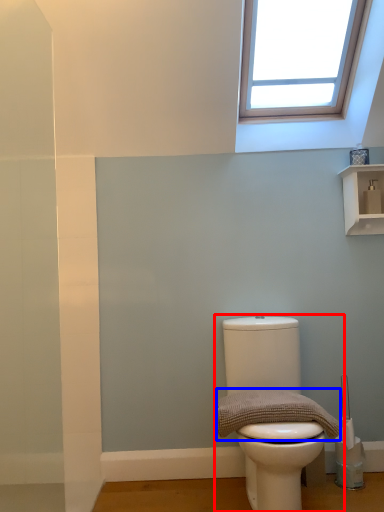
Question: Which of the following is the closest to the observer, toilet (highlighted by a red box) or material (highlighted by a blue box)?

Choices:
 (A) toilet
 (B) material

Answer: (A)